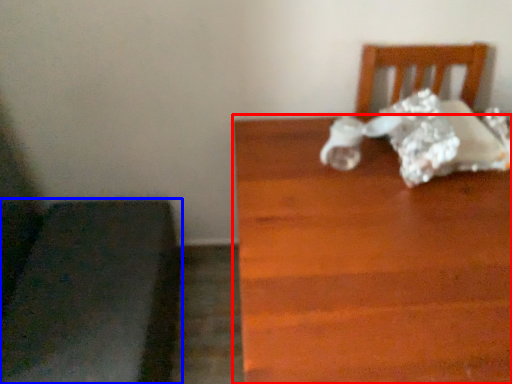
Question: Which of the following is the farthest to the observer, table (highlighted by a red box) or furniture (highlighted by a blue box)?

Choices:
 (A) table
 (B) furniture

Answer: (B)